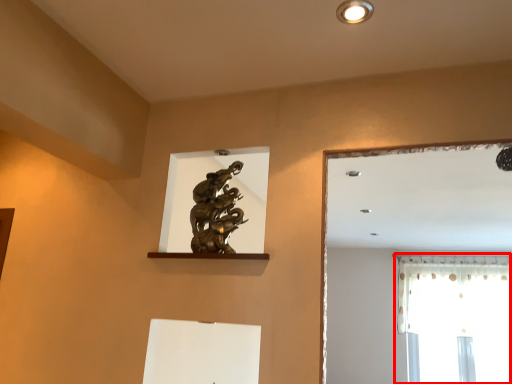
Question: Observing the image, what is the correct spatial positioning of window (annotated by the red box) in reference to lighting?

Choices:
 (A) left
 (B) right

Answer: (B)